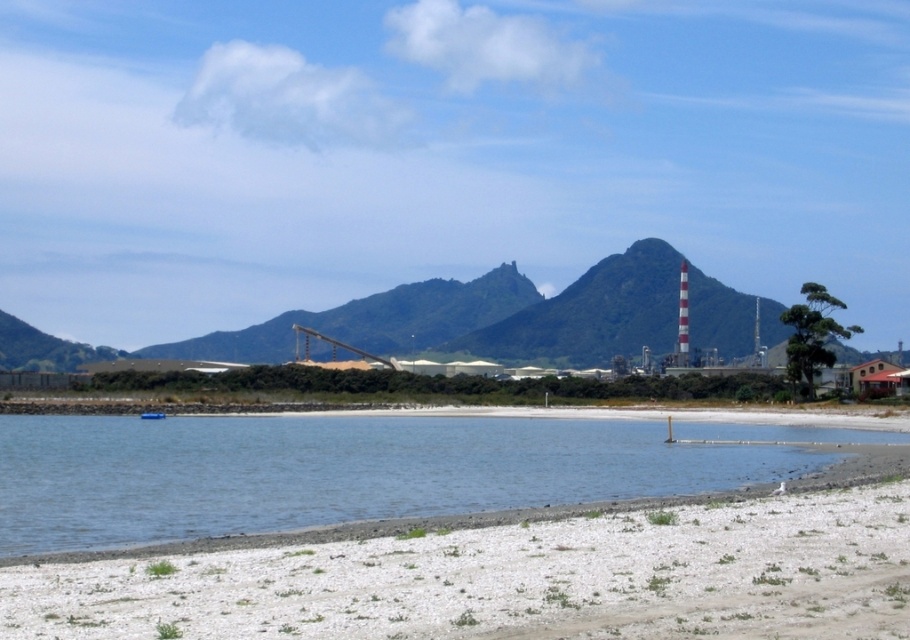
You are standing on the beach and want to place your blue plastic boat at lower left on the white gravelly sand at lower center. Can you fit the boat entirely on the sand without any part hanging off?

The white gravelly sand at lower center might be wider than blue plastic boat at lower left, so there is a possibility that the boat can fit entirely on the sand without any part hanging off, but it depends on the exact dimensions.